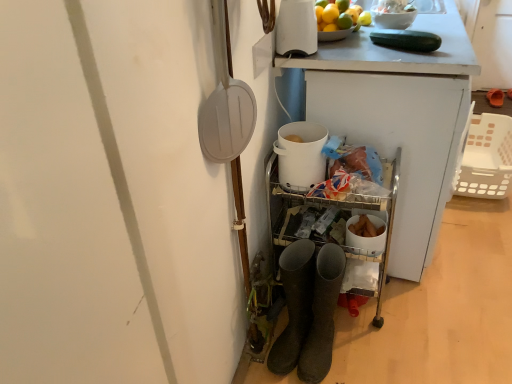
At what (x,y) coordinates should I click in order to perform the action: click on vacant space to the right of dark brown suede boots at lower center, which is the second footwear in back-to-front order. Please return your answer as a coordinate pair (x, y). Looking at the image, I should click on (373, 348).